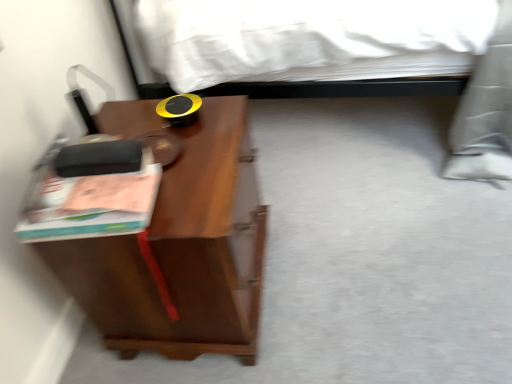
Question: Can you confirm if brown wood nightstand at left is thinner than matte pink paperback book at left?

Choices:
 (A) yes
 (B) no

Answer: (B)

Question: Considering the relative positions of brown wood nightstand at left and matte pink paperback book at left in the image provided, is brown wood nightstand at left to the left of matte pink paperback book at left from the viewer's perspective?

Choices:
 (A) yes
 (B) no

Answer: (B)

Question: From the image's perspective, would you say brown wood nightstand at left is positioned over matte pink paperback book at left?

Choices:
 (A) yes
 (B) no

Answer: (B)

Question: Could matte pink paperback book at left be considered to be inside brown wood nightstand at left?

Choices:
 (A) no
 (B) yes

Answer: (A)

Question: Is brown wood nightstand at left looking in the opposite direction of matte pink paperback book at left?

Choices:
 (A) yes
 (B) no

Answer: (B)

Question: Is brown wood nightstand at left facing towards matte pink paperback book at left?

Choices:
 (A) yes
 (B) no

Answer: (B)

Question: Can you confirm if matte pink paperback book at left is bigger than brown wood nightstand at left?

Choices:
 (A) yes
 (B) no

Answer: (B)

Question: From the image's perspective, would you say matte pink paperback book at left is shown under brown wood nightstand at left?

Choices:
 (A) yes
 (B) no

Answer: (B)

Question: Is matte pink paperback book at left turned away from brown wood nightstand at left?

Choices:
 (A) yes
 (B) no

Answer: (B)

Question: Is matte pink paperback book at left wider than brown wood nightstand at left?

Choices:
 (A) no
 (B) yes

Answer: (A)

Question: Is matte pink paperback book at left not within brown wood nightstand at left?

Choices:
 (A) yes
 (B) no

Answer: (A)

Question: Is matte pink paperback book at left smaller than brown wood nightstand at left?

Choices:
 (A) yes
 (B) no

Answer: (A)

Question: Would you say brown wood nightstand at left is to the left or to the right of matte pink paperback book at left in the picture?

Choices:
 (A) left
 (B) right

Answer: (B)